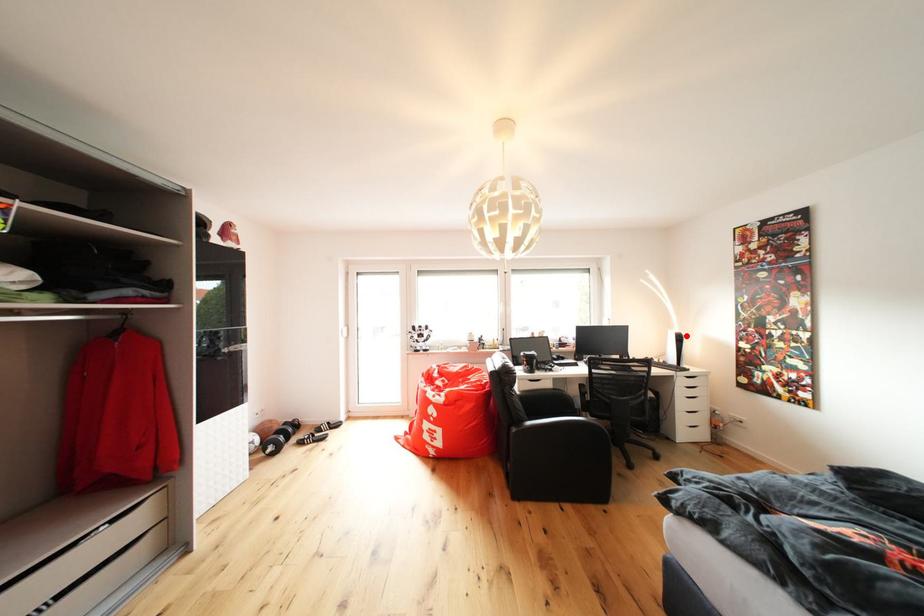
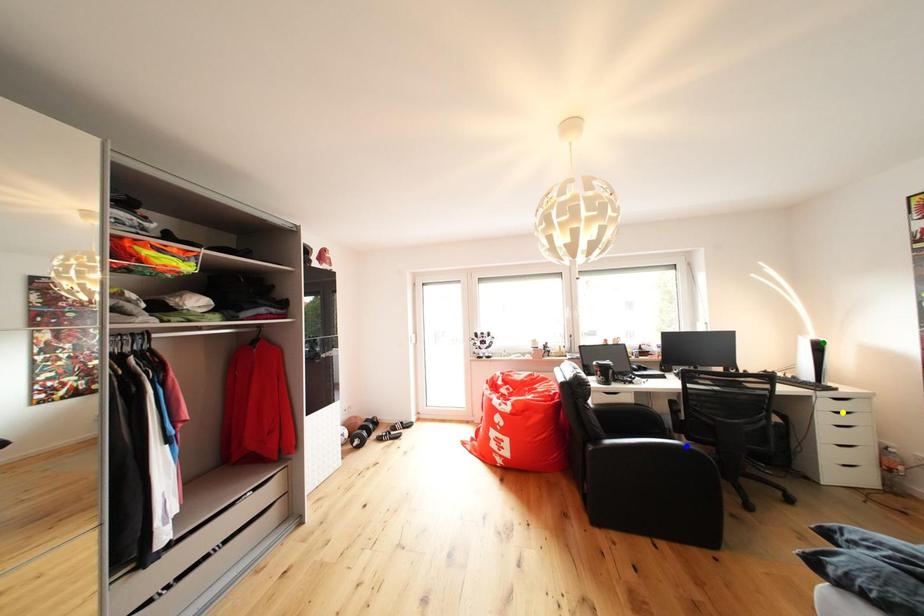
Question: I am providing you with two images of the same scene from different viewpoints. A red point is marked on the first image. You are given multiple points on the second image. In image 2, which mark is for the same physical point as the one in image 1?

Choices:
 (A) blue point
 (B) yellow point
 (C) green point

Answer: (C)